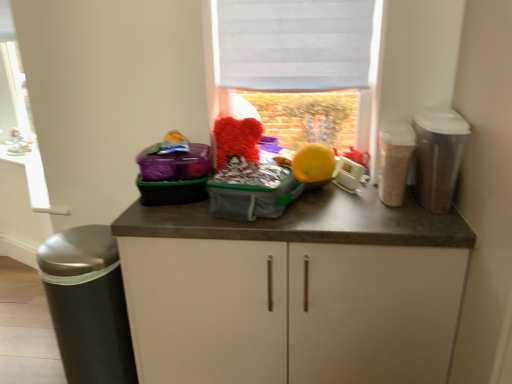
Question: From the image's perspective, is white fabric at upper center on translucent plastic canister at right, the third appliance in the left-to-right sequence?

Choices:
 (A) no
 (B) yes

Answer: (B)

Question: Is white fabric at upper center not inside translucent plastic canister at right, the third appliance in the left-to-right sequence?

Choices:
 (A) no
 (B) yes

Answer: (B)

Question: Considering the relative sizes of white fabric at upper center and translucent plastic canister at right, the third appliance in the left-to-right sequence, in the image provided, is white fabric at upper center smaller than translucent plastic canister at right, the third appliance in the left-to-right sequence,?

Choices:
 (A) no
 (B) yes

Answer: (A)

Question: Does white fabric at upper center contain translucent plastic canister at right, the third appliance in the left-to-right sequence?

Choices:
 (A) yes
 (B) no

Answer: (B)

Question: From a real-world perspective, is white fabric at upper center physically above translucent plastic canister at right, the third appliance in the left-to-right sequence?

Choices:
 (A) no
 (B) yes

Answer: (B)

Question: Is translucent plastic canister at right, the third appliance in the left-to-right sequence, situated inside porcelain figurine at left or outside?

Choices:
 (A) outside
 (B) inside

Answer: (A)

Question: Does point (452, 109) appear closer or farther from the camera than point (14, 135)?

Choices:
 (A) closer
 (B) farther

Answer: (A)

Question: In terms of size, does translucent plastic canister at right, the third appliance in the left-to-right sequence, appear bigger or smaller than porcelain figurine at left?

Choices:
 (A) small
 (B) big

Answer: (B)

Question: Looking at their shapes, would you say translucent plastic canister at right, the first appliance when ordered from right to left, is wider or thinner than porcelain figurine at left?

Choices:
 (A) thin
 (B) wide

Answer: (B)

Question: Is porcelain figurine at left situated inside white fabric blind at upper center or outside?

Choices:
 (A) outside
 (B) inside

Answer: (A)

Question: Is point (10, 152) closer or farther from the camera than point (258, 64)?

Choices:
 (A) farther
 (B) closer

Answer: (A)

Question: From their relative heights in the image, would you say porcelain figurine at left is taller or shorter than white fabric blind at upper center?

Choices:
 (A) short
 (B) tall

Answer: (A)

Question: Is porcelain figurine at left bigger or smaller than white fabric blind at upper center?

Choices:
 (A) small
 (B) big

Answer: (A)

Question: Considering the positions of plastic gray bag at center and white fabric at upper center in the image, is plastic gray bag at center bigger or smaller than white fabric at upper center?

Choices:
 (A) small
 (B) big

Answer: (A)

Question: In the image, is plastic gray bag at center positioned in front of or behind white fabric at upper center?

Choices:
 (A) front
 (B) behind

Answer: (A)